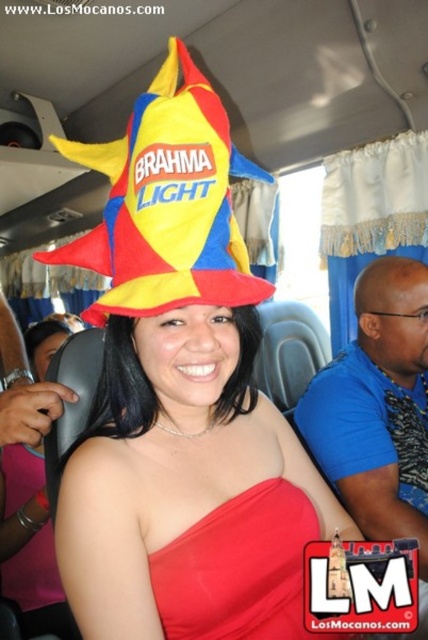
Question: Observing the image, what is the correct spatial positioning of blue fabric shirt at right in reference to red satin dress at center?

Choices:
 (A) below
 (B) above

Answer: (B)

Question: Which point appears closest to the camera in this image?

Choices:
 (A) (275, 596)
 (B) (107, 314)

Answer: (B)

Question: Which is nearer to the blue fabric shirt at right?

Choices:
 (A) matte plastic hat at center
 (B) red satin dress at center
 (C) polyester flag at center

Answer: (A)

Question: Is the position of matte plastic hat at center less distant than that of polyester flag at center?

Choices:
 (A) no
 (B) yes

Answer: (A)

Question: Considering the real-world distances, which object is farthest from the red satin dress at center?

Choices:
 (A) blue fabric shirt at right
 (B) polyester flag at center
 (C) matte plastic hat at center

Answer: (A)

Question: Considering the relative positions of blue fabric shirt at right and red satin dress at center in the image provided, where is blue fabric shirt at right located with respect to red satin dress at center?

Choices:
 (A) left
 (B) right

Answer: (B)